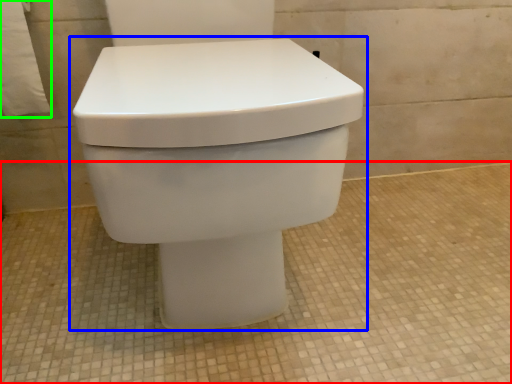
Question: Which object is positioned closest to concrete (highlighted by a red box)? Select from toilet (highlighted by a blue box) and toilet paper (highlighted by a green box).

Choices:
 (A) toilet
 (B) toilet paper

Answer: (A)